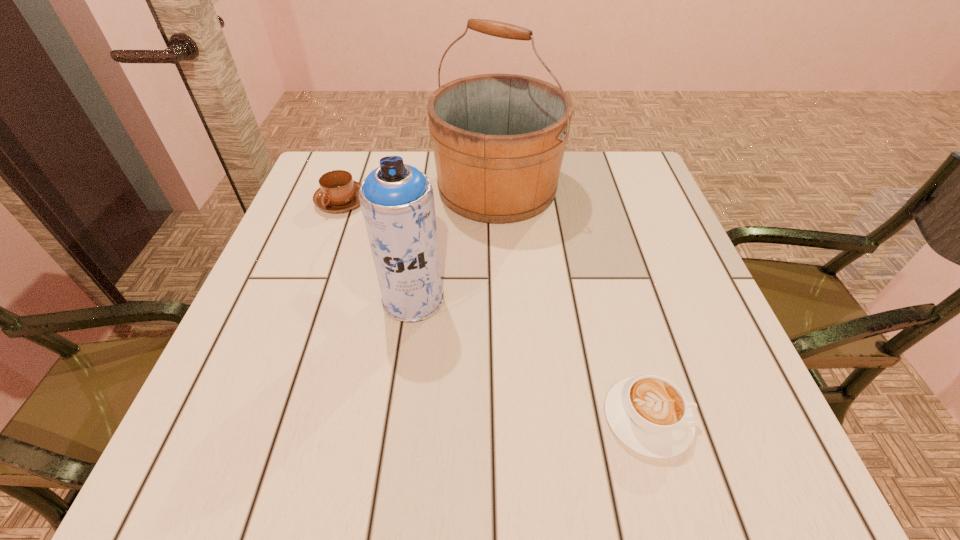
The width and height of the screenshot is (960, 540). Find the location of `the second closest object to the left cappuccino`. the second closest object to the left cappuccino is located at coordinates (397, 200).

This screenshot has height=540, width=960. I want to click on free spot that satisfies the following two spatial constraints: 1. on the back side of the aerosol can; 2. on the right side of the bucket, so click(428, 188).

This screenshot has width=960, height=540. I want to click on vacant region that satisfies the following two spatial constraints: 1. on the side of the leftmost object with the handle; 2. on the right side of the second tallest object, so click(x=306, y=299).

You are a GUI agent. You are given a task and a screenshot of the screen. Output one action in this format:
    pyautogui.click(x=<x>, y=<y>)
    Task: Click on the blank space that satisfies the following two spatial constraints: 1. on the back side of the tallest object; 2. on the right side of the second tallest object
    
    Given the screenshot: What is the action you would take?
    pyautogui.click(x=428, y=188)

Where is `free region that satisfies the following two spatial constraints: 1. on the back side of the third farthest object; 2. on the right side of the tallest object`? free region that satisfies the following two spatial constraints: 1. on the back side of the third farthest object; 2. on the right side of the tallest object is located at coordinates (428, 188).